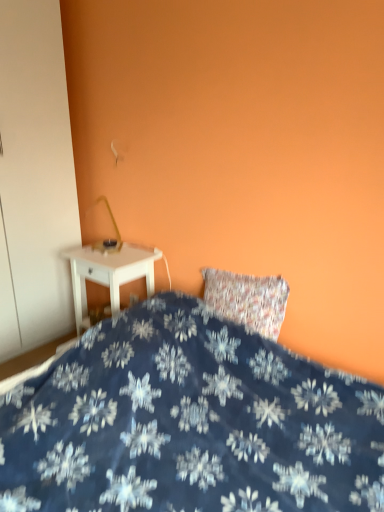
Question: Can you confirm if white plastic electric outlet at lower center is wider than white matte armoire at left?

Choices:
 (A) no
 (B) yes

Answer: (A)

Question: From a real-world perspective, is white plastic electric outlet at lower center over white matte armoire at left?

Choices:
 (A) no
 (B) yes

Answer: (A)

Question: From a real-world perspective, is white plastic electric outlet at lower center beneath white matte armoire at left?

Choices:
 (A) yes
 (B) no

Answer: (A)

Question: Would you say white plastic electric outlet at lower center is a long distance from white matte armoire at left?

Choices:
 (A) no
 (B) yes

Answer: (A)

Question: Considering the relative sizes of white plastic electric outlet at lower center and white matte armoire at left in the image provided, is white plastic electric outlet at lower center shorter than white matte armoire at left?

Choices:
 (A) yes
 (B) no

Answer: (A)

Question: Is white plastic electric outlet at lower center at the left side of white matte armoire at left?

Choices:
 (A) yes
 (B) no

Answer: (B)

Question: Is blue fabric bed at lower center facing away from white matte armoire at left?

Choices:
 (A) no
 (B) yes

Answer: (A)

Question: Does blue fabric bed at lower center appear on the left side of white matte armoire at left?

Choices:
 (A) yes
 (B) no

Answer: (B)

Question: From the image's perspective, is blue fabric bed at lower center beneath white matte armoire at left?

Choices:
 (A) yes
 (B) no

Answer: (A)

Question: From the image's perspective, is blue fabric bed at lower center on top of white matte armoire at left?

Choices:
 (A) yes
 (B) no

Answer: (B)

Question: Would you consider blue fabric bed at lower center to be distant from white matte armoire at left?

Choices:
 (A) yes
 (B) no

Answer: (A)

Question: Is blue fabric bed at lower center positioned before white matte armoire at left?

Choices:
 (A) yes
 (B) no

Answer: (A)

Question: Is white glossy nightstand at left facing towards white plastic electric outlet at lower center?

Choices:
 (A) no
 (B) yes

Answer: (A)